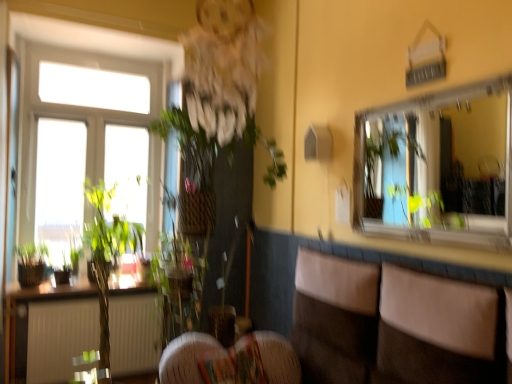
What do you see at coordinates (438, 166) in the screenshot?
I see `clear glass mirror at upper right` at bounding box center [438, 166].

You are a GUI agent. You are given a task and a screenshot of the screen. Output one action in this format:
    pyautogui.click(x=<x>, y=<y>)
    Task: Click on the clear glass mirror at upper right
    The image size is (512, 384).
    Given the screenshot: What is the action you would take?
    pyautogui.click(x=438, y=166)

Locate an element on the screen. Image resolution: width=512 pixels, height=384 pixels. brown leather couch at lower right is located at coordinates (368, 326).

This screenshot has height=384, width=512. Describe the element at coordinates (368, 326) in the screenshot. I see `brown leather couch at lower right` at that location.

Find the location of a particular element. This screenshot has height=384, width=512. clear glass mirror at upper right is located at coordinates (438, 166).

Can you confirm if brown leather couch at lower right is positioned to the left of clear glass mirror at upper right?

Indeed, brown leather couch at lower right is positioned on the left side of clear glass mirror at upper right.

Based on the photo, does brown leather couch at lower right come behind clear glass mirror at upper right?

No.

Does point (396, 334) appear closer or farther from the camera than point (506, 190)?

Point (396, 334) is closer to the camera than point (506, 190).

Looking at this image, from the image's perspective, which is below, brown leather couch at lower right or clear glass mirror at upper right?

brown leather couch at lower right appears lower in the image.

From a real-world perspective, is brown leather couch at lower right physically above clear glass mirror at upper right?

Actually, brown leather couch at lower right is physically below clear glass mirror at upper right in the real world.

Which object is thinner, brown leather couch at lower right or clear glass mirror at upper right?

clear glass mirror at upper right.

Considering the relative sizes of brown leather couch at lower right and clear glass mirror at upper right in the image provided, is brown leather couch at lower right shorter than clear glass mirror at upper right?

Yes, brown leather couch at lower right is shorter than clear glass mirror at upper right.

Which of these two, brown leather couch at lower right or clear glass mirror at upper right, is bigger?

Bigger between the two is brown leather couch at lower right.

Is brown leather couch at lower right completely or partially outside of clear glass mirror at upper right?

brown leather couch at lower right is positioned outside clear glass mirror at upper right.

Is brown leather couch at lower right in contact with clear glass mirror at upper right?

No, brown leather couch at lower right is not touching clear glass mirror at upper right.

Is brown leather couch at lower right turned away from clear glass mirror at upper right?

No, clear glass mirror at upper right is not at the back of brown leather couch at lower right.

At what (x,y) coordinates should I click in order to perform the action: click on mirror to the right of brown leather couch at lower right. Please return your answer as a coordinate pair (x, y). Looking at the image, I should click on (438, 166).

Would you say clear glass mirror at upper right is to the left or to the right of brown leather couch at lower right in the picture?

Based on their positions, clear glass mirror at upper right is located to the right of brown leather couch at lower right.

Between clear glass mirror at upper right and brown leather couch at lower right, which one is positioned in front?

brown leather couch at lower right is closer to the camera.

Considering the positions of point (454, 127) and point (425, 296), is point (454, 127) closer or farther from the camera than point (425, 296)?

Clearly, point (454, 127) is more distant from the camera than point (425, 296).

From the image's perspective, does clear glass mirror at upper right appear lower than brown leather couch at lower right?

No, from the image's perspective, clear glass mirror at upper right is not below brown leather couch at lower right.

From a real-world perspective, is clear glass mirror at upper right physically located above or below brown leather couch at lower right?

clear glass mirror at upper right is situated higher than brown leather couch at lower right in the real world.

Between clear glass mirror at upper right and brown leather couch at lower right, which one has smaller width?

With smaller width is clear glass mirror at upper right.

Can you confirm if clear glass mirror at upper right is shorter than brown leather couch at lower right?

No.

Based on their sizes in the image, would you say clear glass mirror at upper right is bigger or smaller than brown leather couch at lower right?

clear glass mirror at upper right is smaller than brown leather couch at lower right.

Is brown leather couch at lower right surrounded by clear glass mirror at upper right?

Definitely not — brown leather couch at lower right is not inside clear glass mirror at upper right.

Is clear glass mirror at upper right beside brown leather couch at lower right?

There is a gap between clear glass mirror at upper right and brown leather couch at lower right.

Is clear glass mirror at upper right aimed at brown leather couch at lower right?

No, clear glass mirror at upper right is not aimed at brown leather couch at lower right.

What's the angular difference between clear glass mirror at upper right and brown leather couch at lower right's facing directions?

The angle between the facing direction of clear glass mirror at upper right and the facing direction of brown leather couch at lower right is 0.185 degrees.

The width and height of the screenshot is (512, 384). In the image, there is a clear glass mirror at upper right. Identify the location of couch below it (from the image's perspective). (368, 326).

Where is `couch located in front of the clear glass mirror at upper right`? Image resolution: width=512 pixels, height=384 pixels. couch located in front of the clear glass mirror at upper right is located at coordinates (368, 326).

Find the location of a particular element. The width and height of the screenshot is (512, 384). couch on the left of clear glass mirror at upper right is located at coordinates (368, 326).